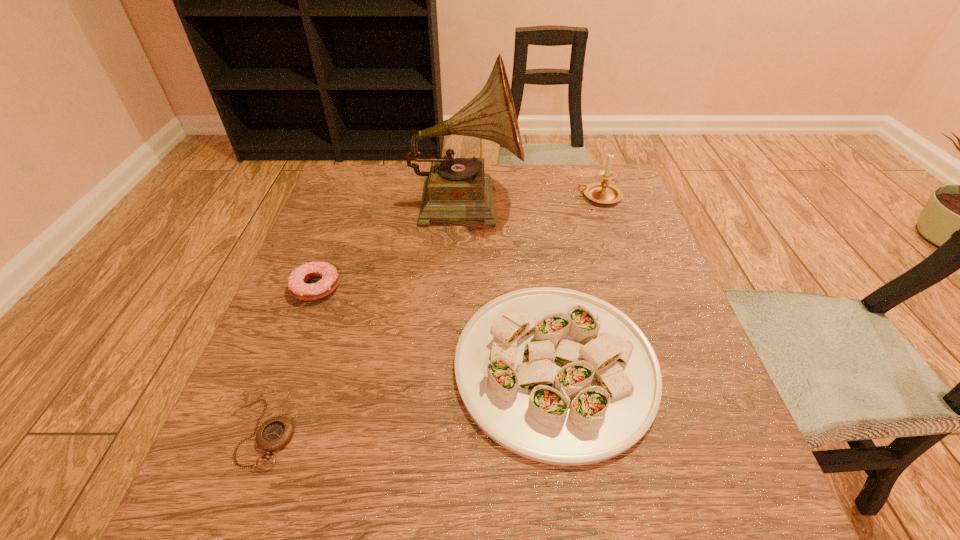
This screenshot has height=540, width=960. Identify the location of vacant space that satisfies the following two spatial constraints: 1. from the horn of the tallest object; 2. on the front side of the doughnut. (463, 287).

You are a GUI agent. You are given a task and a screenshot of the screen. Output one action in this format:
    pyautogui.click(x=<x>, y=<y>)
    Task: Click on the free space that satisfies the following two spatial constraints: 1. on the front side of the pocket watch; 2. on the right side of the doughnut
    
    Given the screenshot: What is the action you would take?
    pyautogui.click(x=261, y=434)

At what (x,y) coordinates should I click in order to perform the action: click on free spot that satisfies the following two spatial constraints: 1. on the front side of the platter; 2. on the right side of the fourth tallest object. Please return your answer as a coordinate pair (x, y). This screenshot has height=540, width=960. Looking at the image, I should click on (287, 366).